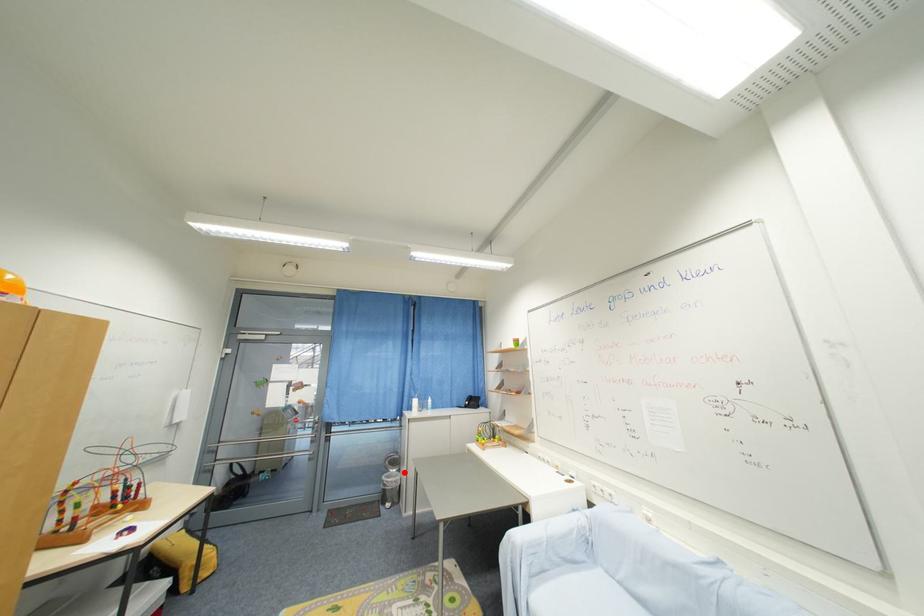
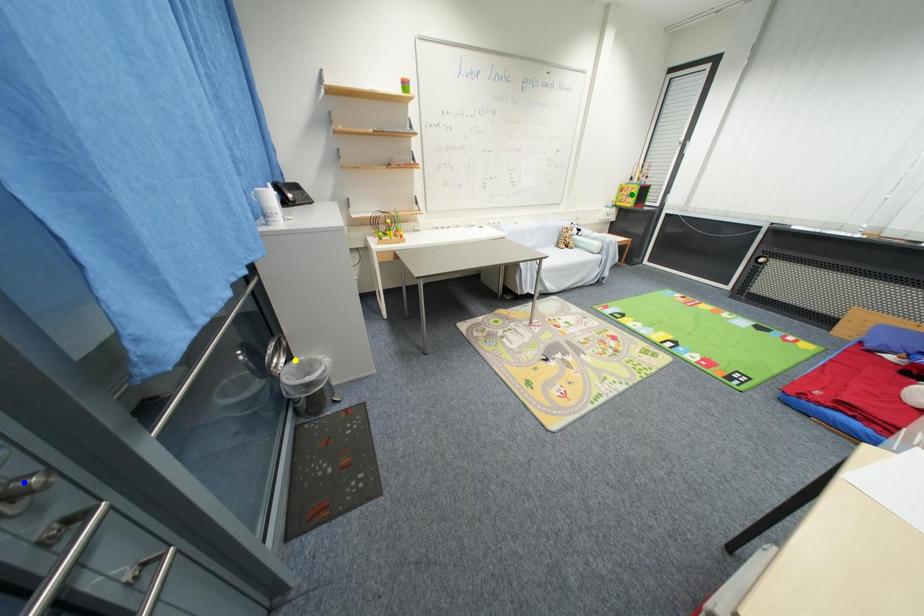
Question: I am providing you with two images of the same scene from different viewpoints. A red point is marked on the first image. You are given multiple points on the second image. Can you choose the point in image 2 that corresponds to the point in image 1?

Choices:
 (A) yellow point
 (B) blue point
 (C) green point

Answer: (A)